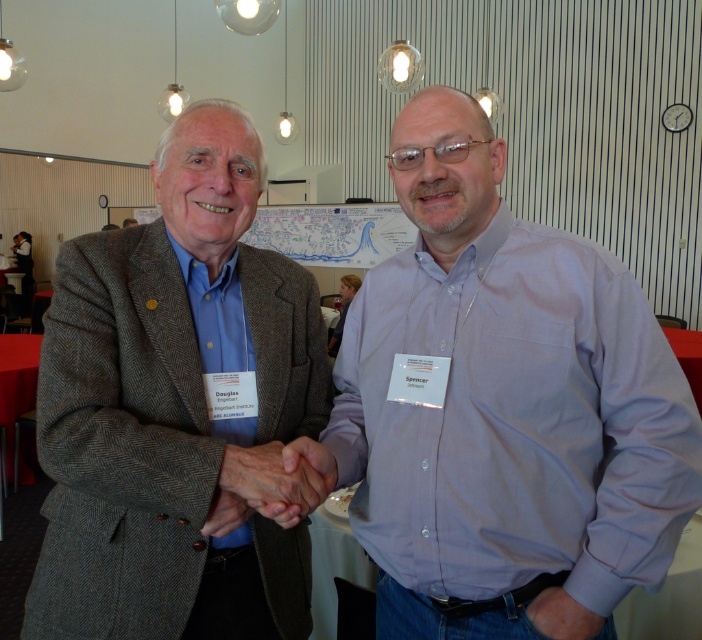
Can you confirm if light blue shirt at center is thinner than smooth skin handshake at center?

No.

Which of these two, light blue shirt at center or smooth skin handshake at center, stands shorter?

smooth skin handshake at center

Find the location of a particular element. The image size is (702, 640). light blue shirt at center is located at coordinates (505, 408).

Where is `light blue shirt at center`? The height and width of the screenshot is (640, 702). light blue shirt at center is located at coordinates (505, 408).

Between light blue shirt at center and gray herringbone blazer at center, which one appears on the right side from the viewer's perspective?

light blue shirt at center is more to the right.

At what (x,y) coordinates should I click in order to perform the action: click on light blue shirt at center. Please return your answer as a coordinate pair (x, y). The width and height of the screenshot is (702, 640). Looking at the image, I should click on (505, 408).

This screenshot has width=702, height=640. I want to click on light blue shirt at center, so click(505, 408).

Does gray herringbone blazer at center lie in front of white paper map at center?

Yes, it is.

Does gray herringbone blazer at center have a larger size compared to white paper map at center?

No, gray herringbone blazer at center is not bigger than white paper map at center.

Identify the location of gray herringbone blazer at center. (173, 410).